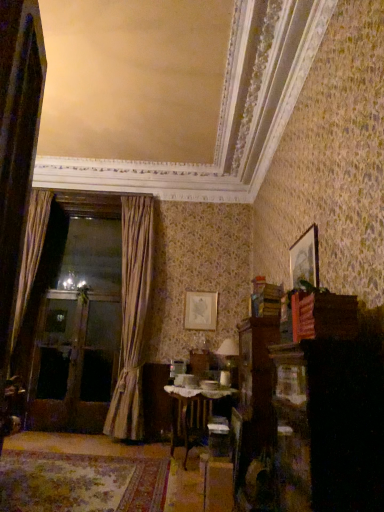
Question: Considering the relative positions of wooden table at center and gold textured curtain at left, the first curtain positioned from the right, in the image provided, is wooden table at center to the left or to the right of gold textured curtain at left, the first curtain positioned from the right,?

Choices:
 (A) right
 (B) left

Answer: (A)

Question: Considering the positions of wooden table at center and gold textured curtain at left, the first curtain positioned from the right, in the image, is wooden table at center taller or shorter than gold textured curtain at left, the first curtain positioned from the right,?

Choices:
 (A) tall
 (B) short

Answer: (B)

Question: Which object is the closest to the matte gold picture frame at center, which ranks as the first picture frame in left-to-right order?

Choices:
 (A) silky beige curtain at left, the 2th curtain in the right-to-left sequence
 (B) wooden picture frame at upper right, which appears as the first picture frame when viewed from the top
 (C) wooden table at center
 (D) gold textured curtain at left, placed as the 2th curtain when sorted from left to right

Answer: (D)

Question: Estimate the real-world distances between objects in this image. Which object is farther from the wooden picture frame at upper right, which is the second picture frame in bottom-to-top order?

Choices:
 (A) silky beige curtain at left, the 2th curtain in the right-to-left sequence
 (B) gold textured curtain at left, the first curtain positioned from the right
 (C) matte gold picture frame at center, which ranks as the first picture frame in left-to-right order
 (D) wooden table at center

Answer: (A)